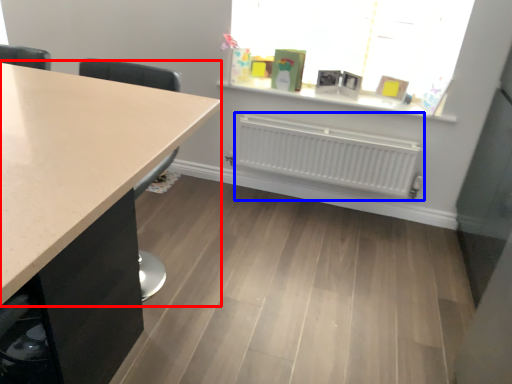
Question: Which point is further to the camera, countertop (highlighted by a red box) or radiator (highlighted by a blue box)?

Choices:
 (A) countertop
 (B) radiator

Answer: (B)